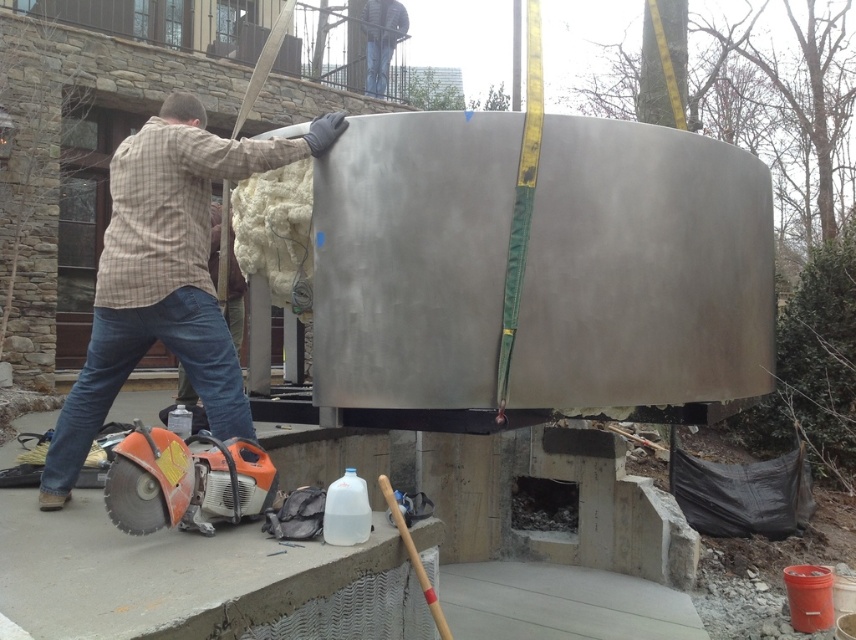
Which is more to the right, plaid shirt at left or orange plastic circular saw at lower left?

orange plastic circular saw at lower left

Who is more distant from viewer, (204, 316) or (179, 456)?

Point (204, 316)

Is point (107, 296) closer to camera compared to point (230, 444)?

No, (107, 296) is behind (230, 444).

I want to click on plaid shirt at left, so click(x=165, y=275).